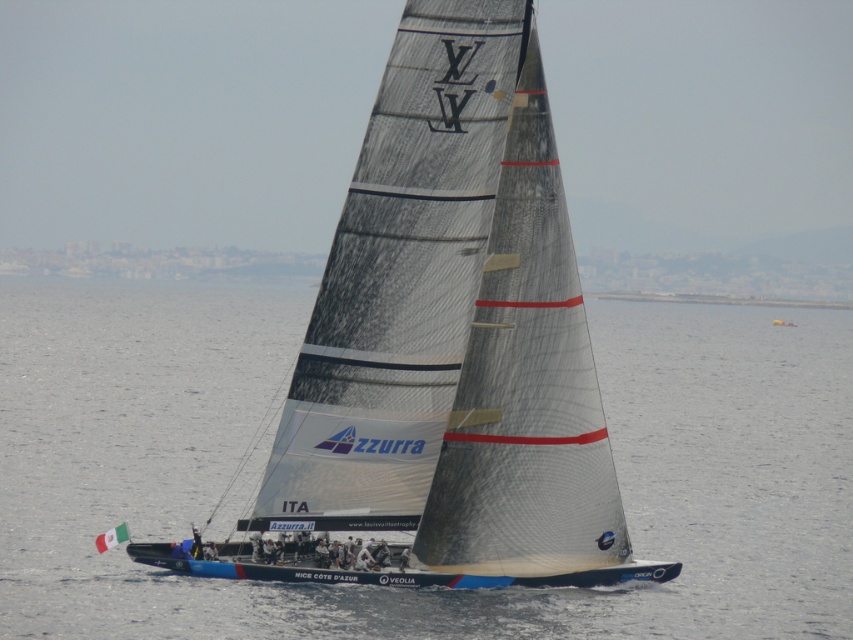
Question: Which of the following is the farthest from the observer?

Choices:
 (A) (450, 83)
 (B) (672, 612)

Answer: (B)

Question: Can you confirm if transparent water at center is smaller than white matte sailboat at center?

Choices:
 (A) yes
 (B) no

Answer: (B)

Question: Does transparent water at center appear under white matte sailboat at center?

Choices:
 (A) no
 (B) yes

Answer: (B)

Question: Is transparent water at center to the right of white matte sailboat at center from the viewer's perspective?

Choices:
 (A) no
 (B) yes

Answer: (B)

Question: Among these objects, which one is farthest from the camera?

Choices:
 (A) transparent water at center
 (B) white matte sailboat at center

Answer: (A)